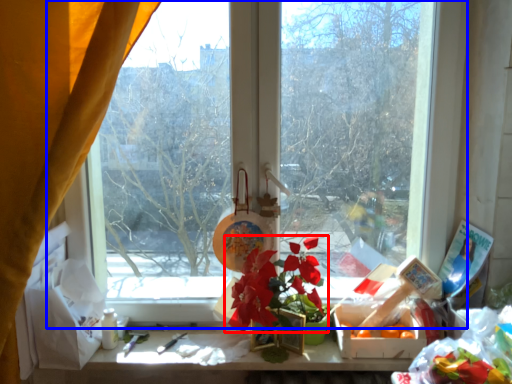
Question: Which point is closer to the camera, flower (highlighted by a red box) or window (highlighted by a blue box)?

Choices:
 (A) flower
 (B) window

Answer: (A)